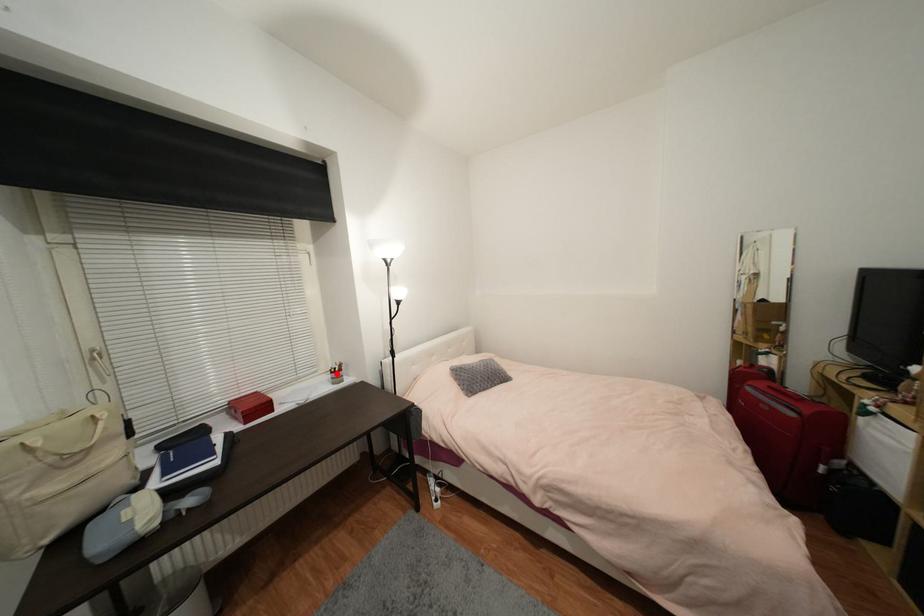
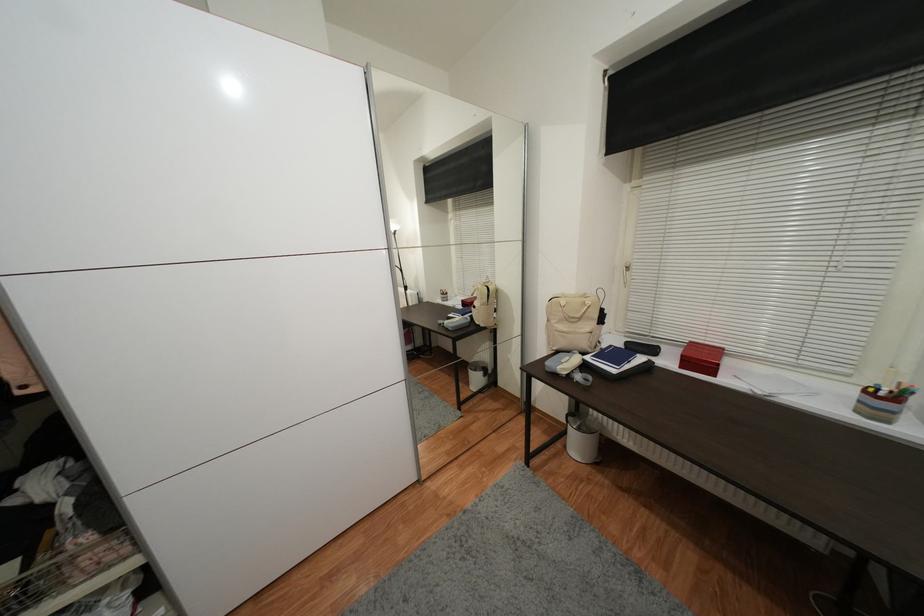
The point at the highlighted location is marked in the first image. Where is the corresponding point in the second image?

(871, 392)